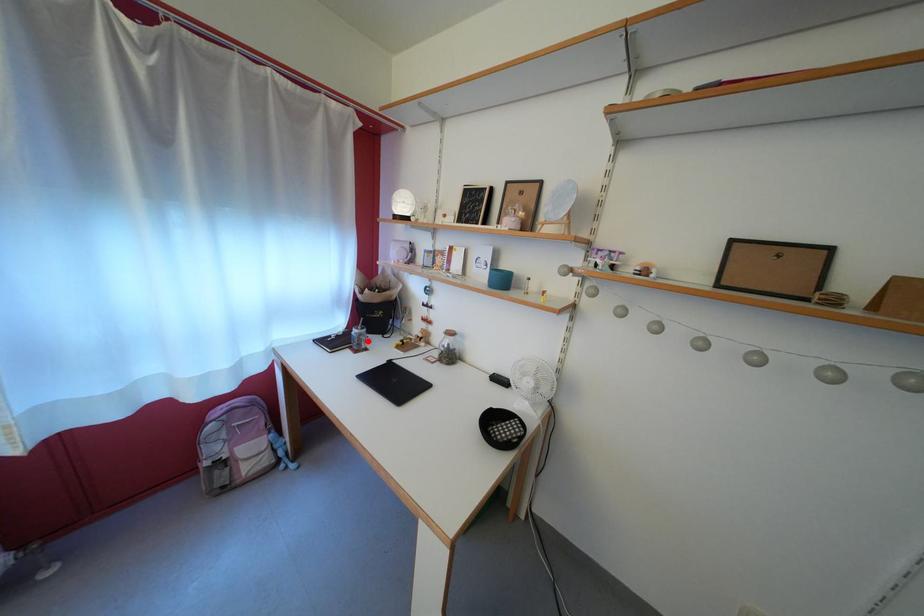
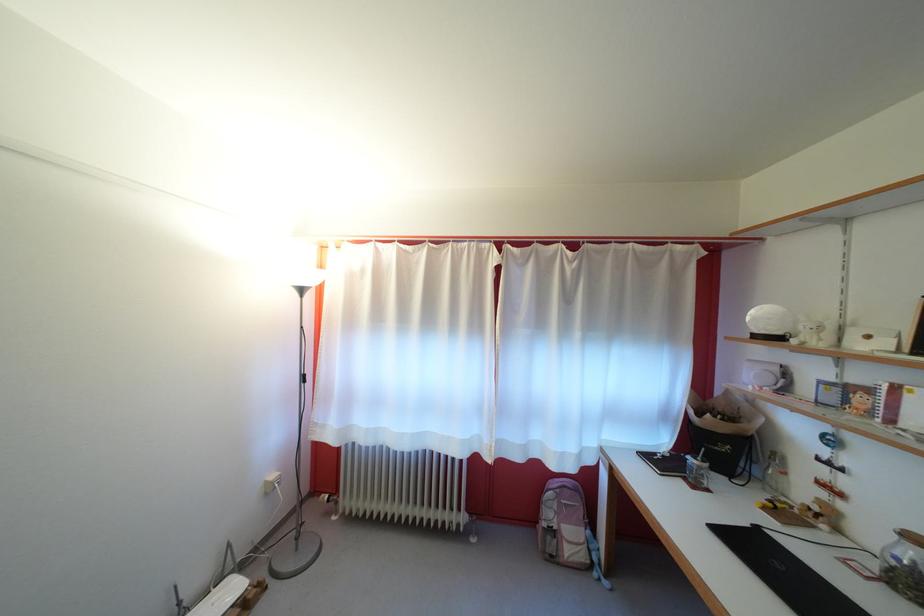
Find the pixel in the second image that matches the highlighted location in the first image.

(708, 474)